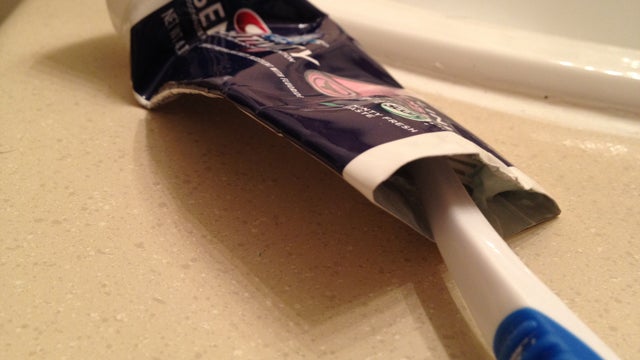
Locate an element on the screen. The image size is (640, 360). backsplash is located at coordinates (569, 16).